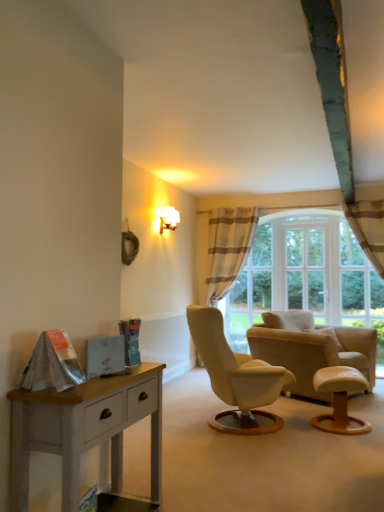
Question: Is white glass window at center far from light brown wooden stool at lower right?

Choices:
 (A) no
 (B) yes

Answer: (B)

Question: Considering the relative sizes of white glass window at center and light brown wooden stool at lower right in the image provided, is white glass window at center shorter than light brown wooden stool at lower right?

Choices:
 (A) no
 (B) yes

Answer: (A)

Question: From the image's perspective, is white glass window at center under light brown wooden stool at lower right?

Choices:
 (A) yes
 (B) no

Answer: (B)

Question: From a real-world perspective, is white glass window at center over light brown wooden stool at lower right?

Choices:
 (A) no
 (B) yes

Answer: (B)

Question: Is white glass window at center beside light brown wooden stool at lower right?

Choices:
 (A) yes
 (B) no

Answer: (B)

Question: From their relative heights in the image, would you say light brown wooden stool at lower right is taller or shorter than striped fabric curtain at center?

Choices:
 (A) short
 (B) tall

Answer: (A)

Question: Considering the positions of light brown wooden stool at lower right and striped fabric curtain at center in the image, is light brown wooden stool at lower right bigger or smaller than striped fabric curtain at center?

Choices:
 (A) big
 (B) small

Answer: (B)

Question: Does point (x=334, y=394) appear closer or farther from the camera than point (x=228, y=234)?

Choices:
 (A) closer
 (B) farther

Answer: (A)

Question: Would you say light brown wooden stool at lower right is inside or outside striped fabric curtain at center?

Choices:
 (A) outside
 (B) inside

Answer: (A)

Question: Would you say white painted wood nightstand at lower left is to the left or to the right of white ribbed radiator at center in the picture?

Choices:
 (A) left
 (B) right

Answer: (A)

Question: Would you say white painted wood nightstand at lower left is inside or outside white ribbed radiator at center?

Choices:
 (A) inside
 (B) outside

Answer: (B)

Question: Is white painted wood nightstand at lower left bigger or smaller than white ribbed radiator at center?

Choices:
 (A) small
 (B) big

Answer: (A)

Question: Considering their positions, is white painted wood nightstand at lower left located in front of or behind white ribbed radiator at center?

Choices:
 (A) behind
 (B) front

Answer: (B)

Question: Is light brown wooden stool at lower right bigger or smaller than white painted wood nightstand at lower left?

Choices:
 (A) small
 (B) big

Answer: (A)

Question: Looking at their shapes, would you say light brown wooden stool at lower right is wider or thinner than white painted wood nightstand at lower left?

Choices:
 (A) thin
 (B) wide

Answer: (B)